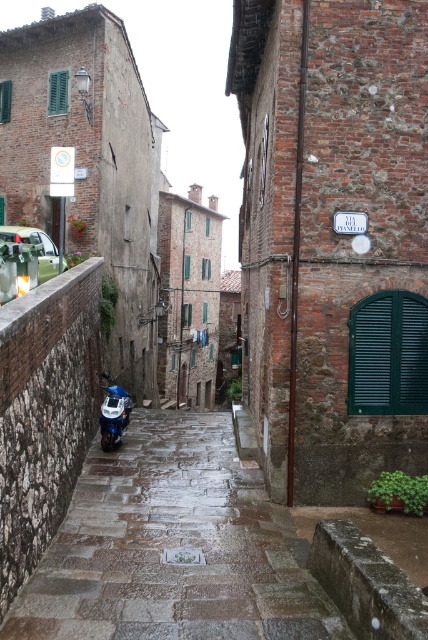
You are a delivery person with a 1.5 meter wide delivery cart. You need to navigate through the rustic stone alley at center and pass by the metallic silver car at left. Can your cart fit through the alley without touching the car?

The rustic stone alley at center might be wider than the metallic silver car at left, so there is a possibility that the delivery cart can fit through the alley without touching the car. However, since the exact width isn t specified, it s recommended to proceed cautiously.

You are a delivery person trying to navigate through the rustic stone alley at center. There is a blue metallic motorcycle at lower left in your path. Based on the scene, can you pass through the alley without moving the motorcycle?

The rustic stone alley at center is located below the blue metallic motorcycle at lower left, which means the motorcycle is positioned higher up or above the alley. Since the alley is narrow and the motorcycle is not blocking the lower part, you can likely pass through the alley without moving the motorcycle.

You are a delivery person who needs to park your vehicle in this narrow street. You have a blue metallic motorcycle at lower left and a metallic silver car at left. Which vehicle takes up less space on the street?

The blue metallic motorcycle at lower left takes up less space on the street because it has a smaller size compared to the metallic silver car at left.